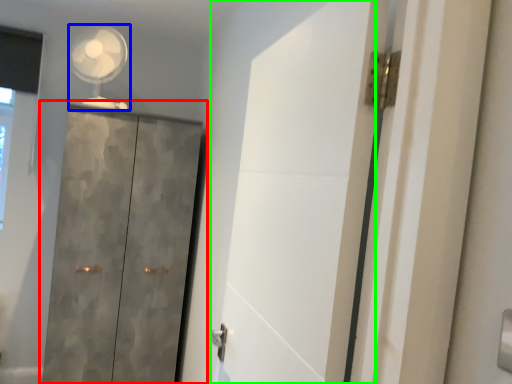
Question: Based on their relative distances, which object is farther from cupboard (highlighted by a red box)? Choose from mechanical fan (highlighted by a blue box) and screen door (highlighted by a green box).

Choices:
 (A) mechanical fan
 (B) screen door

Answer: (B)